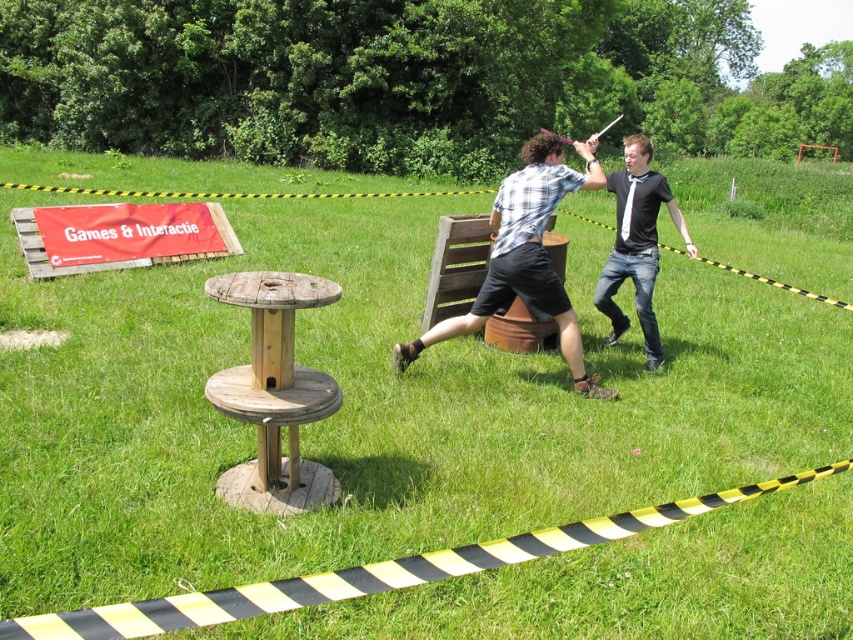
Question: Does plaid shirt at center have a greater width compared to black matte shirt at right?

Choices:
 (A) no
 (B) yes

Answer: (A)

Question: Does plaid shirt at center have a smaller size compared to black matte shirt at right?

Choices:
 (A) no
 (B) yes

Answer: (B)

Question: Can you confirm if plaid shirt at center is positioned above black matte shirt at right?

Choices:
 (A) yes
 (B) no

Answer: (B)

Question: Which point is closer to the camera taking this photo?

Choices:
 (A) (618, 332)
 (B) (550, 305)

Answer: (B)